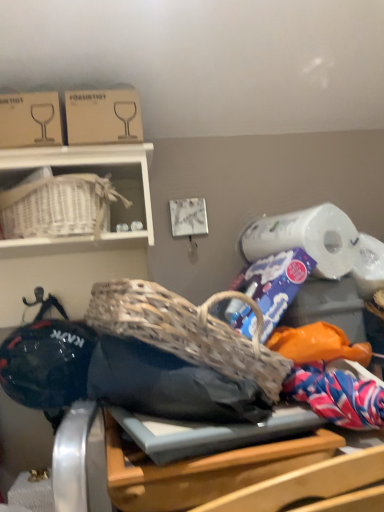
The height and width of the screenshot is (512, 384). Describe the element at coordinates (87, 173) in the screenshot. I see `white wicker basket at upper left` at that location.

This screenshot has height=512, width=384. What do you see at coordinates (103, 116) in the screenshot?
I see `cardboard box at upper left, which ranks as the 1th cardboard box in right-to-left order` at bounding box center [103, 116].

Image resolution: width=384 pixels, height=512 pixels. I want to click on wooden table at center, so click(203, 469).

From a real-world perspective, is wooden table at center located beneath white wicker basket at upper left?

Yes, from a real-world perspective, wooden table at center is under white wicker basket at upper left.

Is the depth of wooden table at center greater than that of white wicker basket at upper left?

No, it is not.

Does wooden table at center have a lesser width compared to white wicker basket at upper left?

Incorrect, the width of wooden table at center is not less than that of white wicker basket at upper left.

In terms of height, does wooden table at center look taller or shorter compared to white wicker basket at upper left?

In the image, wooden table at center appears to be shorter than white wicker basket at upper left.

Which object is further away from the camera taking this photo, cardboard box at upper left, the 1th cardboard box from the left, or cardboard box at upper left, which ranks as the 1th cardboard box in right-to-left order?

cardboard box at upper left, which ranks as the 1th cardboard box in right-to-left order, is more distant.

Does cardboard box at upper left, arranged as the 2th cardboard box when viewed from the right, appear on the left side of cardboard box at upper left, positioned as the 2th cardboard box in left-to-right order?

Indeed, cardboard box at upper left, arranged as the 2th cardboard box when viewed from the right, is positioned on the left side of cardboard box at upper left, positioned as the 2th cardboard box in left-to-right order.

From the picture: Could you tell me if cardboard box at upper left, the 1th cardboard box from the left, is facing cardboard box at upper left, positioned as the 2th cardboard box in left-to-right order?

No, cardboard box at upper left, the 1th cardboard box from the left, does not turn towards cardboard box at upper left, positioned as the 2th cardboard box in left-to-right order.

Between cardboard box at upper left, arranged as the 2th cardboard box when viewed from the right, and cardboard box at upper left, positioned as the 2th cardboard box in left-to-right order, which one has more height?

With more height is cardboard box at upper left, arranged as the 2th cardboard box when viewed from the right.

From a real-world perspective, which is physically above, white wicker basket at upper left or cardboard box at upper left, positioned as the 2th cardboard box in left-to-right order?

From a 3D spatial view, cardboard box at upper left, positioned as the 2th cardboard box in left-to-right order, is above.

Is white wicker basket at upper left beside cardboard box at upper left, which ranks as the 1th cardboard box in right-to-left order?

No, white wicker basket at upper left is not beside cardboard box at upper left, which ranks as the 1th cardboard box in right-to-left order.

How different are the orientations of white wicker basket at upper left and cardboard box at upper left, positioned as the 2th cardboard box in left-to-right order, in degrees?

They differ by 2.55 degrees in their facing directions.

Can you see cardboard box at upper left, positioned as the 2th cardboard box in left-to-right order, touching white wicker basket at upper left?

No, cardboard box at upper left, positioned as the 2th cardboard box in left-to-right order, is not beside white wicker basket at upper left.

From the image's perspective, count 2nd cardboard boxs upward from the white wicker basket at upper left and point to it. Please provide its 2D coordinates.

[(103, 116)]

Does point (93, 96) come in front of point (3, 151)?

That is False.

Could you tell me if cardboard box at upper left, the 1th cardboard box from the left, is turned towards white wicker basket at upper left?

No, cardboard box at upper left, the 1th cardboard box from the left, is not aimed at white wicker basket at upper left.

Based on the photo, from the image's perspective, between cardboard box at upper left, arranged as the 2th cardboard box when viewed from the right, and white wicker basket at upper left, which one is located above?

cardboard box at upper left, arranged as the 2th cardboard box when viewed from the right, is shown above in the image.

Considering the sizes of objects cardboard box at upper left, arranged as the 2th cardboard box when viewed from the right, and white wicker basket at upper left in the image provided, who is thinner, cardboard box at upper left, arranged as the 2th cardboard box when viewed from the right, or white wicker basket at upper left?

Thinner between the two is cardboard box at upper left, arranged as the 2th cardboard box when viewed from the right.

Measure the distance from cardboard box at upper left, arranged as the 2th cardboard box when viewed from the right, to white wicker basket at upper left.

15.46 centimeters.

Considering the relative sizes of white wicker basket at upper left and cardboard box at upper left, the 1th cardboard box from the left, in the image provided, is white wicker basket at upper left wider than cardboard box at upper left, the 1th cardboard box from the left,?

Correct, the width of white wicker basket at upper left exceeds that of cardboard box at upper left, the 1th cardboard box from the left.

Which is behind, point (34, 164) or point (6, 126)?

The point (34, 164) is behind.

This screenshot has height=512, width=384. I want to click on furniture beneath the cardboard box at upper left, arranged as the 2th cardboard box when viewed from the right (from a real-world perspective), so click(87, 173).

Between white wicker basket at upper left and wooden table at center, which one has smaller width?

white wicker basket at upper left is thinner.

Is there a large distance between white wicker basket at upper left and wooden table at center?

They are positioned close to each other.

What's the angular difference between white wicker basket at upper left and wooden table at center's facing directions?

white wicker basket at upper left and wooden table at center are facing 4.96 degrees away from each other.

Would you say white wicker basket at upper left is outside wooden table at center?

white wicker basket at upper left is positioned outside wooden table at center.

Find the location of a particular element. The image size is (384, 512). table below the white wicker basket at upper left (from the image's perspective) is located at coordinates click(x=203, y=469).

Image resolution: width=384 pixels, height=512 pixels. I want to click on cardboard box that appears on the right of cardboard box at upper left, the 1th cardboard box from the left, so click(x=103, y=116).

Which object lies further to the anchor point white wicker basket at upper left, cardboard box at upper left, arranged as the 2th cardboard box when viewed from the right, or cardboard box at upper left, which ranks as the 1th cardboard box in right-to-left order?

Based on the image, cardboard box at upper left, arranged as the 2th cardboard box when viewed from the right, appears to be further to white wicker basket at upper left.

Which object lies nearer to the anchor point cardboard box at upper left, arranged as the 2th cardboard box when viewed from the right, white wicker basket at upper left or cardboard box at upper left, which ranks as the 1th cardboard box in right-to-left order?

cardboard box at upper left, which ranks as the 1th cardboard box in right-to-left order, is closer to cardboard box at upper left, arranged as the 2th cardboard box when viewed from the right.

Considering their positions, is wooden table at center positioned further to cardboard box at upper left, the 1th cardboard box from the left, than cardboard box at upper left, positioned as the 2th cardboard box in left-to-right order?

The object further to cardboard box at upper left, the 1th cardboard box from the left, is wooden table at center.

Considering their positions, is cardboard box at upper left, which ranks as the 1th cardboard box in right-to-left order, positioned further to white wicker basket at upper left than wooden table at center?

wooden table at center is further to white wicker basket at upper left.

Estimate the real-world distances between objects in this image. Which object is closer to wooden table at center, white wicker basket at upper left or cardboard box at upper left, arranged as the 2th cardboard box when viewed from the right?

Based on the image, white wicker basket at upper left appears to be nearer to wooden table at center.

Looking at the image, which one is located closer to cardboard box at upper left, which ranks as the 1th cardboard box in right-to-left order, white wicker basket at upper left or cardboard box at upper left, arranged as the 2th cardboard box when viewed from the right?

Among the two, cardboard box at upper left, arranged as the 2th cardboard box when viewed from the right, is located nearer to cardboard box at upper left, which ranks as the 1th cardboard box in right-to-left order.

Looking at the image, which one is located further to cardboard box at upper left, which ranks as the 1th cardboard box in right-to-left order, cardboard box at upper left, arranged as the 2th cardboard box when viewed from the right, or white wicker basket at upper left?

The object further to cardboard box at upper left, which ranks as the 1th cardboard box in right-to-left order, is white wicker basket at upper left.

Considering their positions, is cardboard box at upper left, which ranks as the 1th cardboard box in right-to-left order, positioned further to wooden table at center than cardboard box at upper left, the 1th cardboard box from the left?

The object further to wooden table at center is cardboard box at upper left, the 1th cardboard box from the left.

The height and width of the screenshot is (512, 384). Find the location of `cardboard box that lies between cardboard box at upper left, positioned as the 2th cardboard box in left-to-right order, and white wicker basket at upper left from top to bottom`. cardboard box that lies between cardboard box at upper left, positioned as the 2th cardboard box in left-to-right order, and white wicker basket at upper left from top to bottom is located at coordinates (30, 120).

In order to click on cardboard box between cardboard box at upper left, positioned as the 2th cardboard box in left-to-right order, and wooden table at center vertically in this screenshot , I will do `click(30, 120)`.

Find the location of a particular element. This screenshot has height=512, width=384. furniture between cardboard box at upper left, the 1th cardboard box from the left, and wooden table at center from top to bottom is located at coordinates (87, 173).

Where is `furniture between cardboard box at upper left, positioned as the 2th cardboard box in left-to-right order, and wooden table at center, in the vertical direction`? furniture between cardboard box at upper left, positioned as the 2th cardboard box in left-to-right order, and wooden table at center, in the vertical direction is located at coordinates (87, 173).